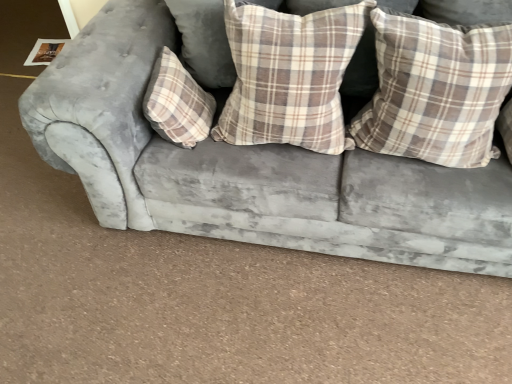
Question: From a real-world perspective, relative to velvet gray couch at center, is plaid fabric pillow at center, the third pillow positioned from the right, vertically above or below?

Choices:
 (A) below
 (B) above

Answer: (B)

Question: From the image's perspective, is plaid fabric pillow at center, the third pillow positioned from the right, above or below velvet gray couch at center?

Choices:
 (A) below
 (B) above

Answer: (A)

Question: Which is nearer to the plaid fabric pillow at center, the first pillow in the left-to-right sequence?

Choices:
 (A) plaid fabric pillow at center, the 2th pillow from the right
 (B) velvet gray couch at center
 (C) plaid fabric pillow at upper right, the first pillow in the right-to-left sequence

Answer: (B)

Question: Estimate the real-world distances between objects in this image. Which object is farther from the plaid fabric pillow at upper right, the first pillow in the right-to-left sequence?

Choices:
 (A) plaid fabric pillow at center, the third pillow positioned from the right
 (B) plaid fabric pillow at center, the second pillow when ordered from left to right
 (C) velvet gray couch at center

Answer: (A)